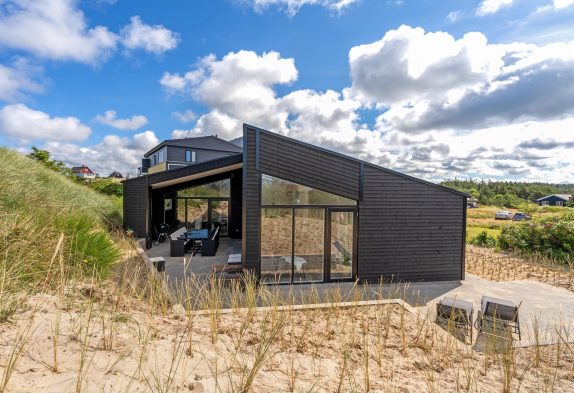
Where is `chairs`? This screenshot has width=574, height=393. chairs is located at coordinates (506, 308), (457, 312).